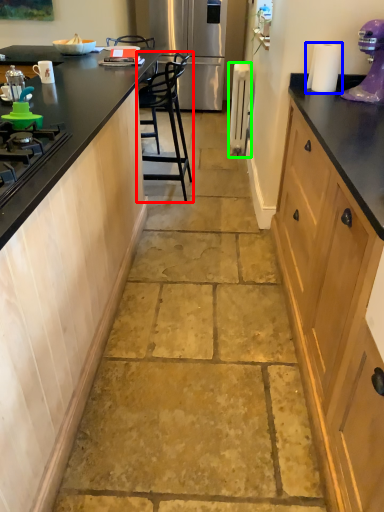
Question: Estimate the real-world distances between objects in this image. Which object is closer to chair (highlighted by a red box), paper towel (highlighted by a blue box) or appliance (highlighted by a green box)?

Choices:
 (A) paper towel
 (B) appliance

Answer: (A)